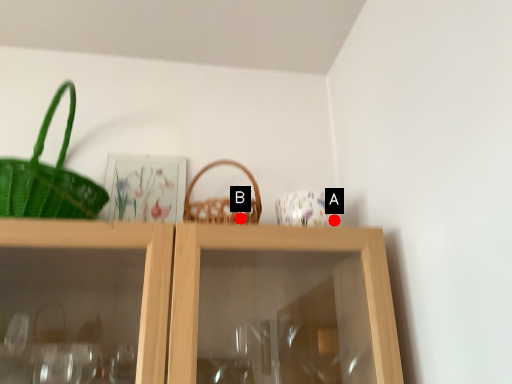
Question: Two points are circled on the image, labeled by A and B beside each circle. Which point is closer to the camera?

Choices:
 (A) A is closer
 (B) B is closer

Answer: (B)